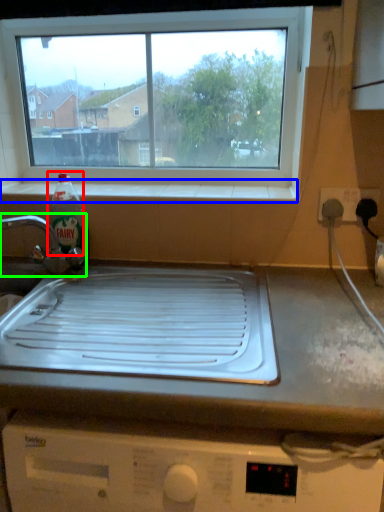
Question: Which is nearer to the bottle (highlighted by a red box)? window sill (highlighted by a blue box) or tap (highlighted by a green box).

Choices:
 (A) window sill
 (B) tap

Answer: (B)